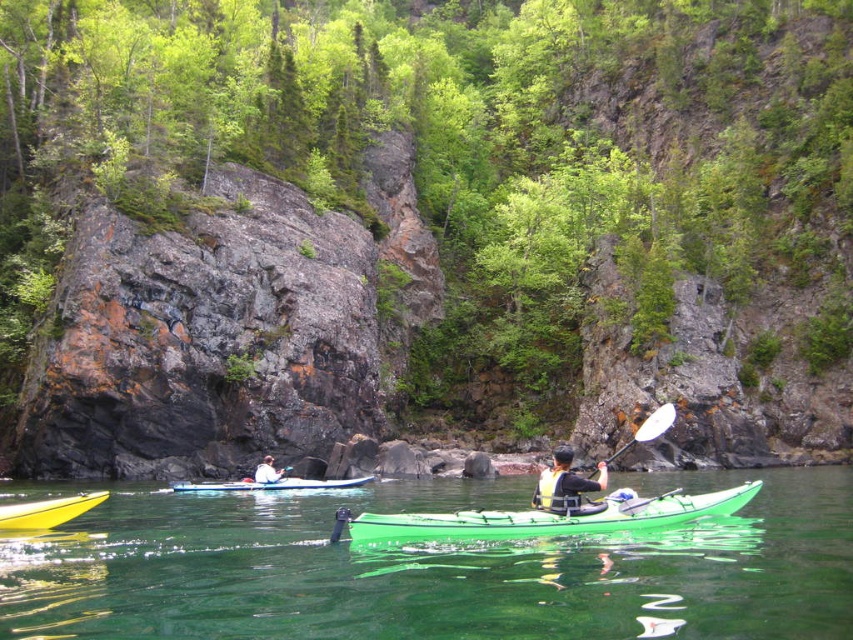
Is white plastic paddle at center further to camera compared to white plastic paddle at center-right?

No, it is in front of white plastic paddle at center-right.

Does point (646, 420) come farther from viewer compared to point (654, 420)?

That is True.

Who is more distant from viewer, (548, 470) or (657, 413)?

Point (548, 470)

Identify the location of white plastic paddle at center. (593, 472).

Identify the location of green plastic kayak at center. This screenshot has height=640, width=853. (437, 570).

Is green plastic kayak at center to the right of yellow life vest at center from the viewer's perspective?

Incorrect, green plastic kayak at center is not on the right side of yellow life vest at center.

This screenshot has width=853, height=640. I want to click on green plastic kayak at center, so click(437, 570).

At what (x,y) coordinates should I click in order to perform the action: click on green plastic kayak at center. Please return your answer as a coordinate pair (x, y). The width and height of the screenshot is (853, 640). Looking at the image, I should click on (437, 570).

Is green matte kayak at center above white plastic paddle at center-right?

Actually, green matte kayak at center is below white plastic paddle at center-right.

Is green matte kayak at center taller than white plastic paddle at center-right?

No.

Is point (357, 518) closer to camera compared to point (636, 442)?

Yes, point (357, 518) is closer to viewer.

Locate an element on the screen. The height and width of the screenshot is (640, 853). green matte kayak at center is located at coordinates (550, 516).